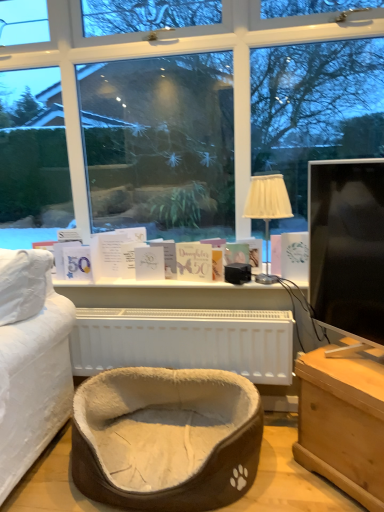
The height and width of the screenshot is (512, 384). Describe the element at coordinates (267, 209) in the screenshot. I see `beige fabric lampshade at center` at that location.

I want to click on beige plush pet bed at center, so click(166, 438).

What do you see at coordinates (194, 261) in the screenshot? The image size is (384, 512). I see `matte gold card at center, placed as the second book when sorted from left to right` at bounding box center [194, 261].

Describe the element at coordinates (347, 247) in the screenshot. I see `black glossy monitor at right` at that location.

What is the approximate height of black glossy monitor at right?

black glossy monitor at right is 28.07 inches in height.

Image resolution: width=384 pixels, height=512 pixels. Describe the element at coordinates (295, 257) in the screenshot. I see `white paper book at right, arranged as the 3th book when viewed from the left` at that location.

Locate an element on the screen. The width and height of the screenshot is (384, 512). white paper book at right, arranged as the 3th book when viewed from the left is located at coordinates (295, 257).

Locate an element on the screen. white plastic radiator at center is located at coordinates click(185, 341).

Is white paper card at center, the first book viewed from the left, oriented towards beige fabric lampshade at center?

No.

From a real-world perspective, relative to beige fabric lampshade at center, is white paper card at center, positioned as the third book in right-to-left order, vertically above or below?

→ In terms of real-world spatial position, white paper card at center, positioned as the third book in right-to-left order, is below beige fabric lampshade at center.

Can you tell me how much white paper card at center, positioned as the third book in right-to-left order, and beige fabric lampshade at center differ in facing direction?

16.8 degrees separate the facing orientations of white paper card at center, positioned as the third book in right-to-left order, and beige fabric lampshade at center.

Is white paper card at center, positioned as the third book in right-to-left order, taller than beige fabric lampshade at center?

Incorrect, the height of white paper card at center, positioned as the third book in right-to-left order, is not larger of that of beige fabric lampshade at center.

Considering the positions of objects white paper book at right, arranged as the 3th book when viewed from the left, and matte gold card at center, placed as the second book when sorted from left to right, in the image provided, who is behind, white paper book at right, arranged as the 3th book when viewed from the left, or matte gold card at center, placed as the second book when sorted from left to right,?

matte gold card at center, placed as the second book when sorted from left to right.

Could you measure the distance between white paper book at right, the 1th book from the right, and matte gold card at center, placed as the second book when sorted from left to right?

The distance of white paper book at right, the 1th book from the right, from matte gold card at center, placed as the second book when sorted from left to right, is 14.87 inches.

Is point (290, 262) behind point (211, 272)?

No, it is not.

Is white paper book at right, the 1th book from the right, far away from matte gold card at center, placed as the second book when sorted from left to right?

white paper book at right, the 1th book from the right, is near matte gold card at center, placed as the second book when sorted from left to right, not far away.

Where is `book that is the 2nd object located above the light brown wooden chest at lower right (from the image's perspective)`? Image resolution: width=384 pixels, height=512 pixels. book that is the 2nd object located above the light brown wooden chest at lower right (from the image's perspective) is located at coordinates (194, 261).

Is point (211, 264) closer or farther from the camera than point (338, 367)?

Point (211, 264) appears to be farther away from the viewer than point (338, 367).

From the image's perspective, is matte gold card at center, placed as the second book when sorted from left to right, beneath light brown wooden chest at lower right?

No, from the image's perspective, matte gold card at center, placed as the second book when sorted from left to right, is not beneath light brown wooden chest at lower right.

Is matte gold card at center, placed as the second book when sorted from left to right, in front of or behind light brown wooden chest at lower right in the image?

matte gold card at center, placed as the second book when sorted from left to right, is positioned farther from the viewer than light brown wooden chest at lower right.

Can you confirm if matte gold card at center, which ranks as the second book in right-to-left order, is thinner than beige fabric lampshade at center?

Yes, matte gold card at center, which ranks as the second book in right-to-left order, is thinner than beige fabric lampshade at center.

Which point is more distant from viewer, (x=187, y=265) or (x=258, y=189)?

The point (x=187, y=265) is behind.

Identify the location of table lamp above the matte gold card at center, which ranks as the second book in right-to-left order (from a real-world perspective). (267, 209).

From the image's perspective, which is above, matte gold card at center, which ranks as the second book in right-to-left order, or beige fabric lampshade at center?

beige fabric lampshade at center is shown above in the image.

Based on the photo, who is shorter, matte gold card at center, placed as the second book when sorted from left to right, or white plastic radiator at center?

Standing shorter between the two is matte gold card at center, placed as the second book when sorted from left to right.

Is matte gold card at center, which ranks as the second book in right-to-left order, not inside white plastic radiator at center?

matte gold card at center, which ranks as the second book in right-to-left order, is positioned outside white plastic radiator at center.

Would you say matte gold card at center, placed as the second book when sorted from left to right, is to the left or to the right of white plastic radiator at center in the picture?

From the image, it's evident that matte gold card at center, placed as the second book when sorted from left to right, is to the right of white plastic radiator at center.

Is matte gold card at center, placed as the second book when sorted from left to right, positioned behind white plastic radiator at center?

Yes, it is behind white plastic radiator at center.

Is point (199, 277) farther from camera compared to point (309, 168)?

Yes.

Is matte gold card at center, which ranks as the second book in right-to-left order, taller than black glossy monitor at right?

Incorrect, the height of matte gold card at center, which ranks as the second book in right-to-left order, is not larger of that of black glossy monitor at right.

Does matte gold card at center, placed as the second book when sorted from left to right, come in front of black glossy monitor at right?

That is False.

From a real-world perspective, is white plastic radiator at center positioned over white paper book at right, arranged as the 3th book when viewed from the left, based on gravity?

No, from a real-world perspective, white plastic radiator at center is not above white paper book at right, arranged as the 3th book when viewed from the left.

Are white plastic radiator at center and white paper book at right, the 1th book from the right, located far from each other?

No, white plastic radiator at center is not far away from white paper book at right, the 1th book from the right.

Which is in front, point (228, 311) or point (289, 248)?

Positioned in front is point (289, 248).

Where is `table lamp above the white paper card at center, the first book viewed from the left (from the image's perspective)`? This screenshot has width=384, height=512. table lamp above the white paper card at center, the first book viewed from the left (from the image's perspective) is located at coordinates (267, 209).

Identify the location of book lying in front of the matte gold card at center, which ranks as the second book in right-to-left order. The height and width of the screenshot is (512, 384). (295, 257).

Looking at the image, which one is located further to matte gold card at center, placed as the second book when sorted from left to right, white plastic radiator at center or light brown wooden chest at lower right?

light brown wooden chest at lower right is positioned further to the anchor matte gold card at center, placed as the second book when sorted from left to right.

Considering their positions, is beige fabric lampshade at center positioned further to light brown wooden chest at lower right than white paper card at center, the first book viewed from the left?

The object further to light brown wooden chest at lower right is white paper card at center, the first book viewed from the left.

Looking at the image, which one is located closer to matte gold card at center, which ranks as the second book in right-to-left order, white paper card at center, the first book viewed from the left, or beige plush pet bed at center?

white paper card at center, the first book viewed from the left, lies closer to matte gold card at center, which ranks as the second book in right-to-left order, than the other object.

Based on their spatial positions, is white plastic radiator at center or light brown wooden chest at lower right further from white paper card at center, positioned as the third book in right-to-left order?

light brown wooden chest at lower right.

Looking at the image, which one is located further to light brown wooden chest at lower right, beige plush pet bed at center or matte gold card at center, placed as the second book when sorted from left to right?

matte gold card at center, placed as the second book when sorted from left to right, is further to light brown wooden chest at lower right.

Estimate the real-world distances between objects in this image. Which object is closer to white paper card at center, the first book viewed from the left, matte gold card at center, placed as the second book when sorted from left to right, or white paper book at right, arranged as the 3th book when viewed from the left?

The object closer to white paper card at center, the first book viewed from the left, is matte gold card at center, placed as the second book when sorted from left to right.

Looking at the image, which one is located further to light brown wooden chest at lower right, white paper card at center, the first book viewed from the left, or black glossy monitor at right?

The object further to light brown wooden chest at lower right is white paper card at center, the first book viewed from the left.

From the image, which object appears to be farther from matte gold card at center, which ranks as the second book in right-to-left order, black glossy monitor at right or white paper card at center, the first book viewed from the left?

Among the two, black glossy monitor at right is located further to matte gold card at center, which ranks as the second book in right-to-left order.

Where is `book between matte gold card at center, placed as the second book when sorted from left to right, and beige plush pet bed at center vertically`? The width and height of the screenshot is (384, 512). book between matte gold card at center, placed as the second book when sorted from left to right, and beige plush pet bed at center vertically is located at coordinates (149, 263).

You are a GUI agent. You are given a task and a screenshot of the screen. Output one action in this format:
    pyautogui.click(x=<x>, y=<y>)
    Task: Click on the book between white paper card at center, the first book viewed from the left, and beige fabric lampshade at center from left to right
    Image resolution: width=384 pixels, height=512 pixels.
    Given the screenshot: What is the action you would take?
    pyautogui.click(x=194, y=261)

Locate an element on the screen. Image resolution: width=384 pixels, height=512 pixels. table lamp between matte gold card at center, which ranks as the second book in right-to-left order, and white paper book at right, arranged as the 3th book when viewed from the left, in the horizontal direction is located at coordinates (267, 209).

Locate an element on the screen. table lamp positioned between black glossy monitor at right and white paper book at right, the 1th book from the right, from near to far is located at coordinates (267, 209).